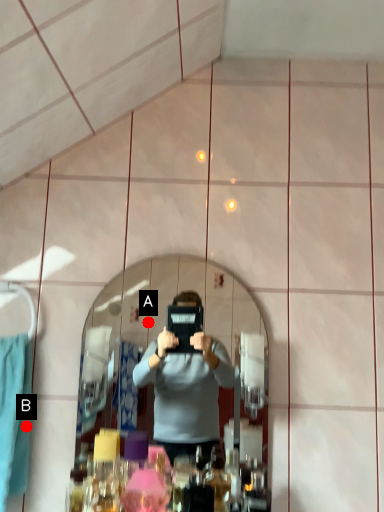
Question: Two points are circled on the image, labeled by A and B beside each circle. Which point is further to the camera?

Choices:
 (A) A is further
 (B) B is further

Answer: (A)